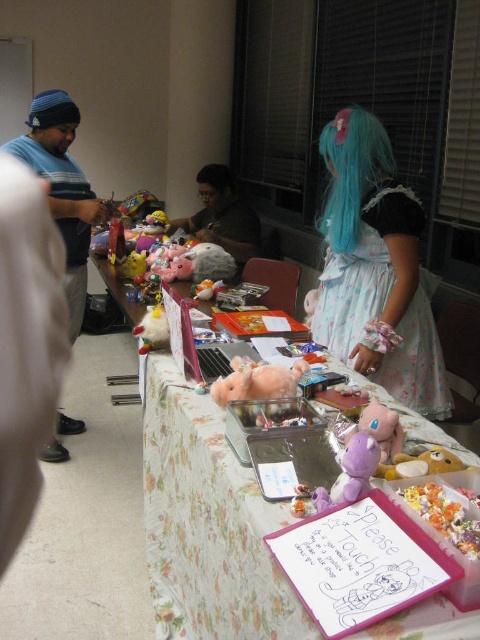
You are a customer at the craft fair and want to pick up the fluffy pink stuffed animal at center. There is a dark gray shirt at center in the way. Can you reach the stuffed animal without moving the shirt?

The dark gray shirt at center is taller than the fluffy pink stuffed animal at center, so it might block your view or access. You may need to move the shirt to reach the stuffed animal.

What is located at the point with coordinates (351, 172)?

The point at coordinates (351, 172) marks the location of the blue silky wig at upper center.